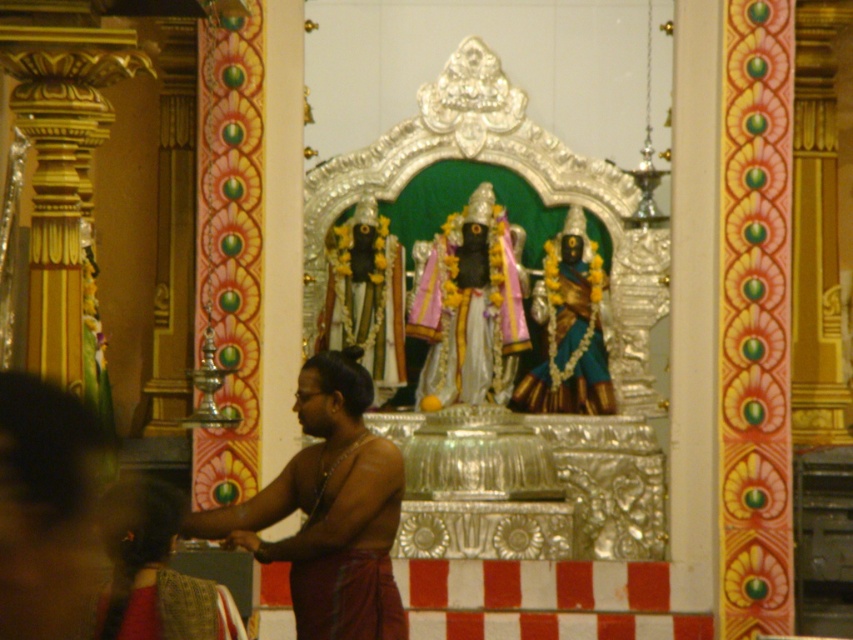
You are standing in the temple and want to place a 20 feet long decorative banner between the brown silk monk at center and the blue glossy statue at center. Can the banner fit between them?

The distance between the brown silk monk at center and the blue glossy statue at center is 77.16 feet, so the 20 feet long banner can easily fit between them.

You are standing in the temple and want to locate the point at coordinates (328, 509). Where exactly is this point located on the brown silk monk at center?

The point at coordinates (328, 509) is located on the brown silk monk at center.